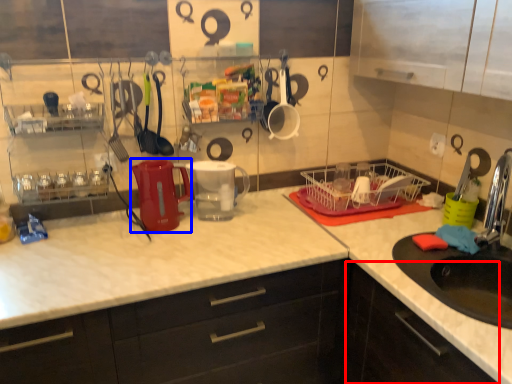
Question: Which object appears farthest to the camera in this image, cabinetry (highlighted by a red box) or appliance (highlighted by a blue box)?

Choices:
 (A) cabinetry
 (B) appliance

Answer: (B)